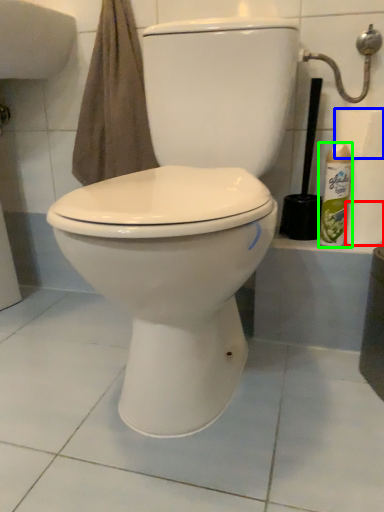
Question: Based on their relative distances, which object is farther from toilet paper (highlighted by a red box)? Choose from toilet paper (highlighted by a blue box) and cleaning product (highlighted by a green box).

Choices:
 (A) toilet paper
 (B) cleaning product

Answer: (A)